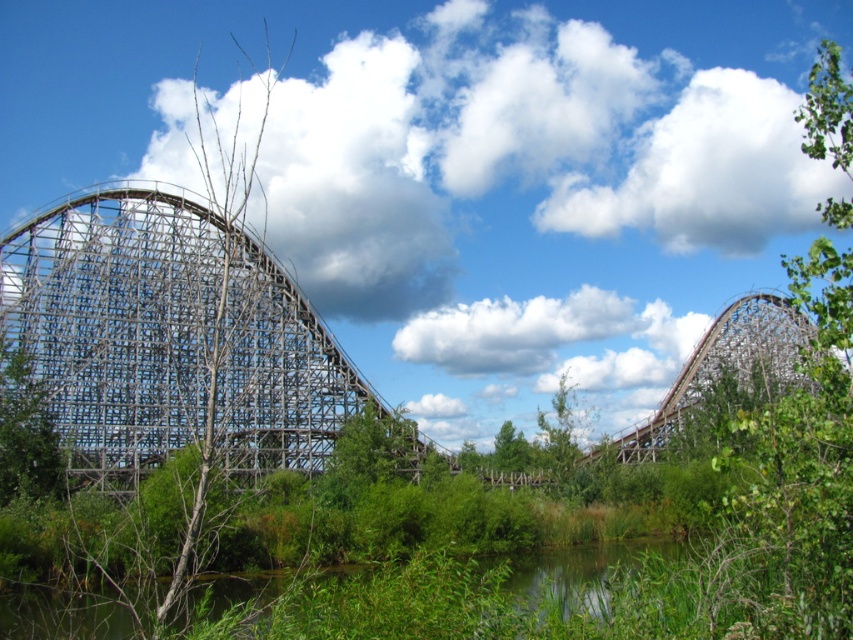
Question: Among these points, which one is farthest from the camera?

Choices:
 (A) (3, 435)
 (B) (44, 634)

Answer: (A)

Question: Which point is closer to the camera taking this photo?

Choices:
 (A) (12, 376)
 (B) (97, 612)
 (C) (363, 456)

Answer: (B)

Question: Is green grassy river at lower center behind green wood tree at left?

Choices:
 (A) no
 (B) yes

Answer: (A)

Question: Can you confirm if green wood tree at left is positioned below green leafy tree at center?

Choices:
 (A) no
 (B) yes

Answer: (A)

Question: Among these objects, which one is nearest to the camera?

Choices:
 (A) green wood tree at left
 (B) green grassy river at lower center
 (C) green leafy tree at center

Answer: (B)

Question: Does green grassy river at lower center appear under green wood tree at left?

Choices:
 (A) no
 (B) yes

Answer: (B)